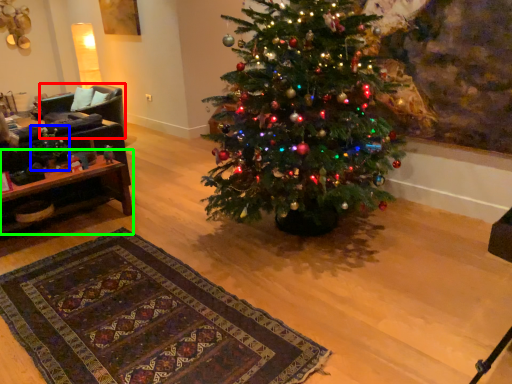
Question: Considering the real-world distances, which object is closest to armchair (highlighted by a red box)? christmas decoration (highlighted by a blue box) or table (highlighted by a green box).

Choices:
 (A) christmas decoration
 (B) table

Answer: (A)